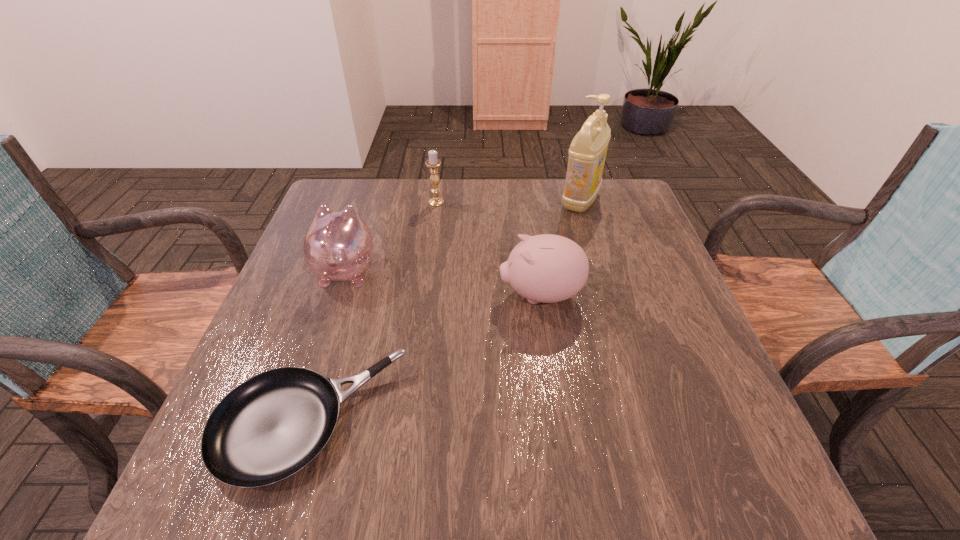
The image size is (960, 540). In order to click on unoccupied position between the tallest object and the candle holder in this screenshot , I will do `click(509, 201)`.

Locate an element on the screen. This screenshot has height=540, width=960. vacant area that lies between the candle holder and the left piggy bank is located at coordinates 391,236.

You are a GUI agent. You are given a task and a screenshot of the screen. Output one action in this format:
    pyautogui.click(x=<x>, y=<y>)
    Task: Click on the free space between the detergent and the shortest object
    The image size is (960, 540).
    Given the screenshot: What is the action you would take?
    pyautogui.click(x=444, y=311)

Locate an element on the screen. The image size is (960, 540). vacant area that lies between the pan and the detergent is located at coordinates (444, 311).

Find the location of a particular element. The height and width of the screenshot is (540, 960). empty space between the pan and the right piggy bank is located at coordinates (424, 359).

Find the location of `vacant space that's between the candle holder and the shortest object`. vacant space that's between the candle holder and the shortest object is located at coordinates (372, 312).

Identify which object is the second closest to the candle holder. Please provide its 2D coordinates. Your answer should be formatted as a tuple, i.e. [(x, y)], where the tuple contains the x and y coordinates of a point satisfying the conditions above.

[(547, 268)]

Locate which object ranks second in proximity to the right piggy bank. Please provide its 2D coordinates. Your answer should be formatted as a tuple, i.e. [(x, y)], where the tuple contains the x and y coordinates of a point satisfying the conditions above.

[(587, 153)]

I want to click on vacant space that satisfies the following two spatial constraints: 1. on the front facing side of the left piggy bank; 2. on the left side of the tallest object, so click(x=369, y=200).

Image resolution: width=960 pixels, height=540 pixels. In order to click on vacant region that satisfies the following two spatial constraints: 1. on the front side of the tallest object; 2. at the snout of the right piggy bank in this screenshot , I will do `click(609, 295)`.